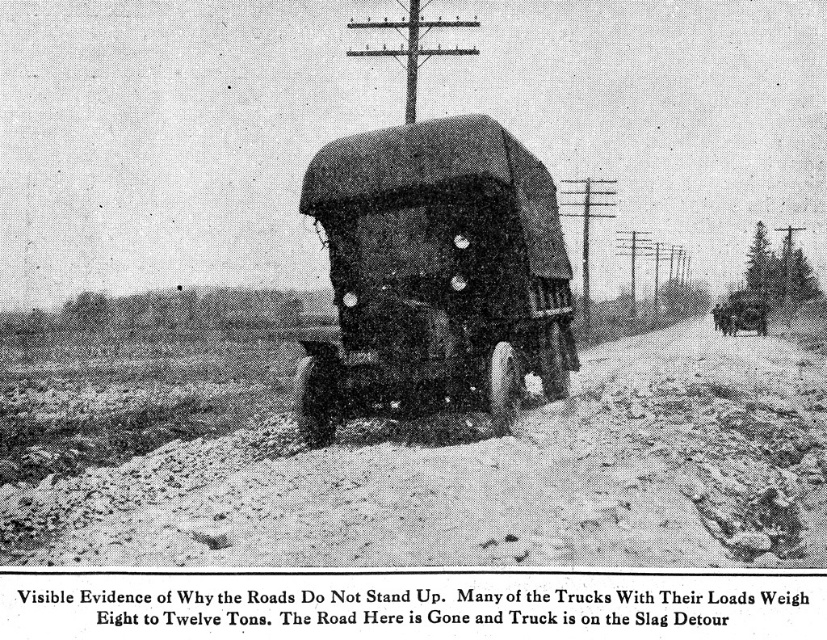
Based on the scene described, which object, the dusty gravel road at center or the dark matte truck at center, has a greater height measurement?

The dusty gravel road at center is taller than the dark matte truck at center.

You are a city planner examining this historical photo. You need to determine which object occupies more space in the image to prioritize road repair efforts. Which is larger in size between the dusty gravel road at center and the dark matte truck at center?

The dusty gravel road at center is larger in size than the dark matte truck at center, so the road would require more attention for repair efforts.

You are a driver approaching the scene and see the dusty gravel road at center and the dark matte truck at center. Which object is nearer to you as you approach?

The dusty gravel road at center is closer to the viewer than the dark matte truck at center, so the road is nearer.